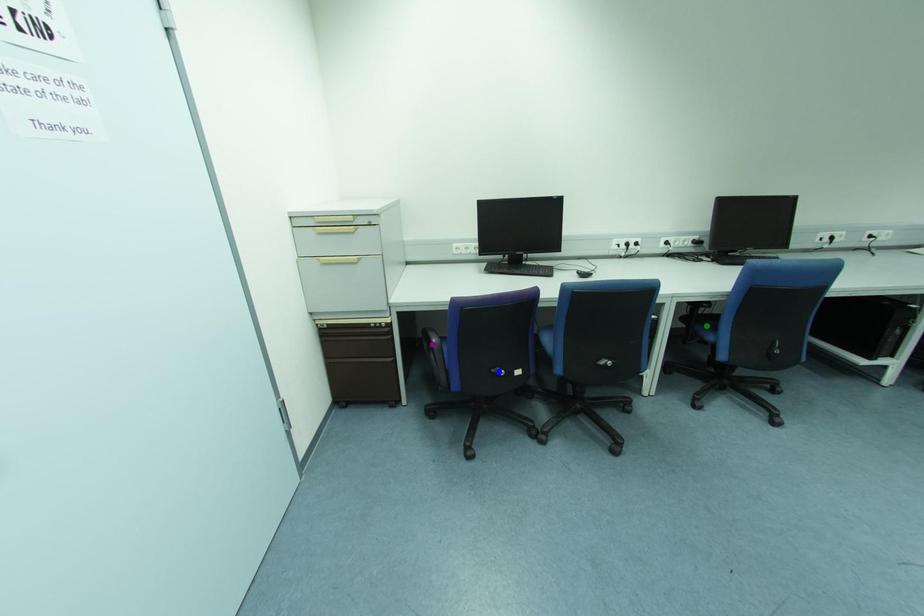
Order these from nearest to farthest:
- blue point
- purple point
- green point

1. green point
2. purple point
3. blue point